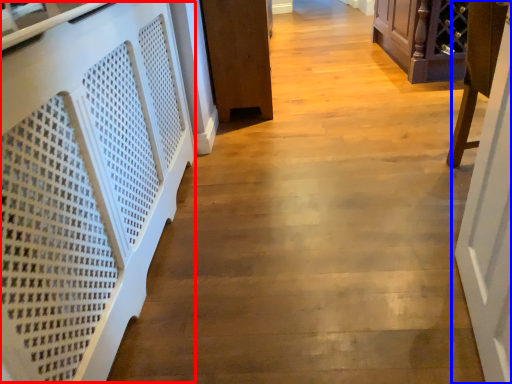
Question: Among these objects, which one is farthest to the camera, stairwell (highlighted by a red box) or door (highlighted by a blue box)?

Choices:
 (A) stairwell
 (B) door

Answer: (B)